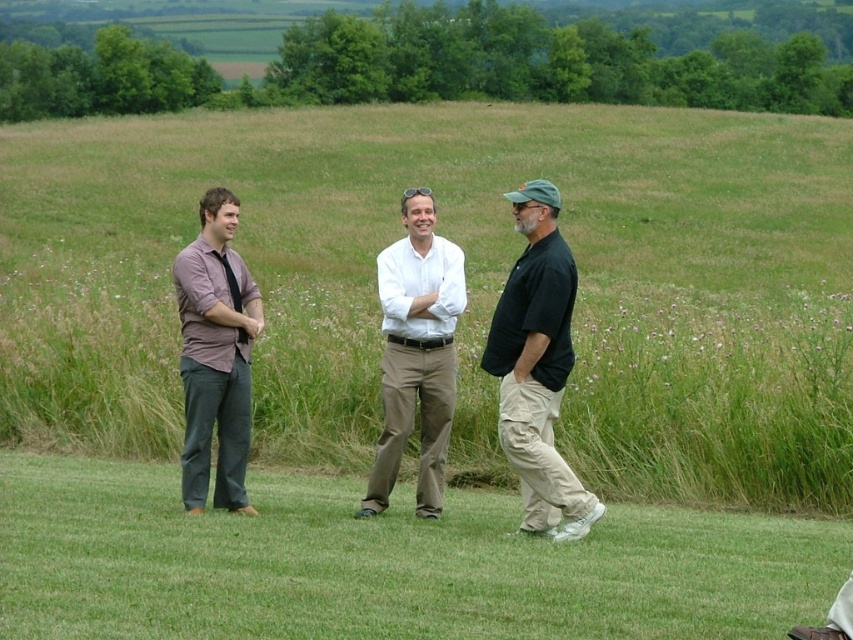
Can you confirm if khaki pants at right is positioned above matte purple shirt at left?

Actually, khaki pants at right is below matte purple shirt at left.

Does khaki pants at right lie in front of matte purple shirt at left?

Yes, it is in front of matte purple shirt at left.

You are a GUI agent. You are given a task and a screenshot of the screen. Output one action in this format:
    pyautogui.click(x=<x>, y=<y>)
    Task: Click on the khaki pants at right
    This screenshot has height=640, width=853.
    Given the screenshot: What is the action you would take?
    pyautogui.click(x=537, y=365)

The image size is (853, 640). Identify the location of khaki pants at right. (537, 365).

Is light brown cotton pants at center wider than matte purple shirt at left?

No.

Does point (422, 328) come closer to viewer compared to point (247, 358)?

Yes, point (422, 328) is closer to viewer.

Image resolution: width=853 pixels, height=640 pixels. Find the location of `light brown cotton pants at center`. light brown cotton pants at center is located at coordinates [416, 353].

Between khaki pants at right and light brown cotton pants at center, which one has less height?

light brown cotton pants at center

Is khaki pants at right to the right of light brown cotton pants at center from the viewer's perspective?

Indeed, khaki pants at right is positioned on the right side of light brown cotton pants at center.

What do you see at coordinates (537, 365) in the screenshot?
I see `khaki pants at right` at bounding box center [537, 365].

At what (x,y) coordinates should I click in order to perform the action: click on khaki pants at right. Please return your answer as a coordinate pair (x, y). The height and width of the screenshot is (640, 853). Looking at the image, I should click on (537, 365).